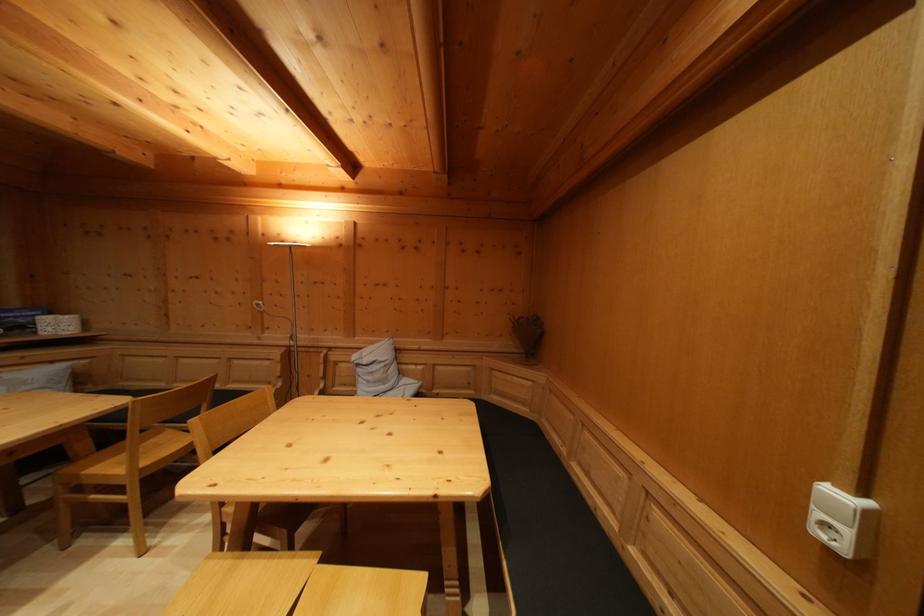
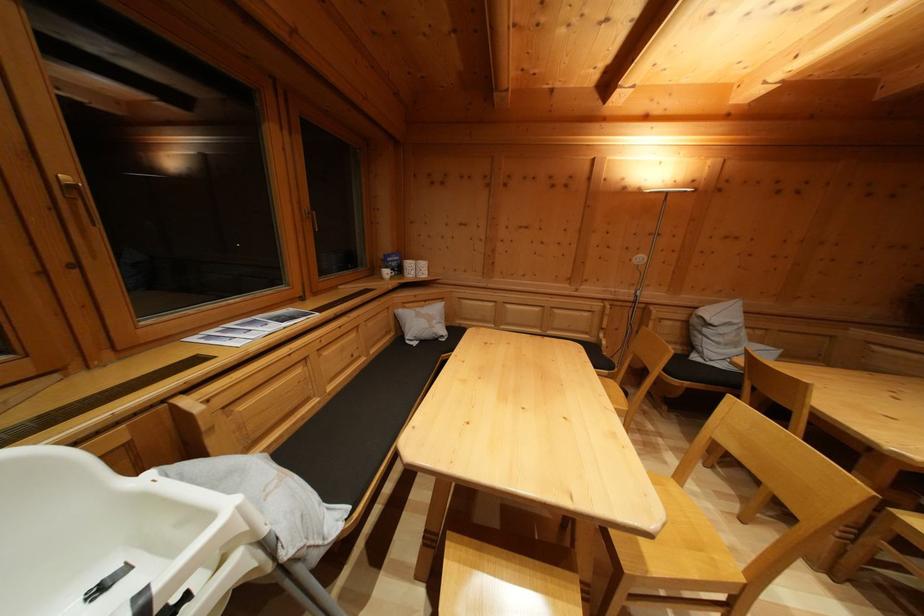
The point at (58, 369) is marked in the first image. Where is the corresponding point in the second image?

(431, 308)